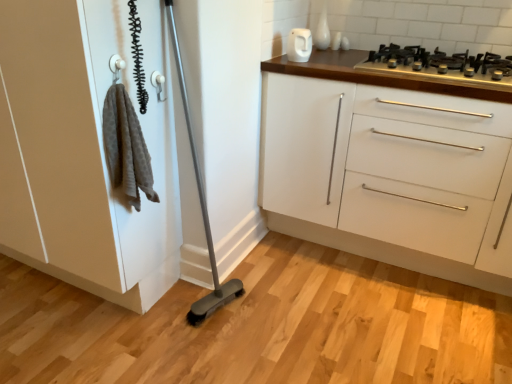
Based on the photo, what is the approximate width of black metal gas stove at upper right?

The width of black metal gas stove at upper right is 22.91 inches.

Image resolution: width=512 pixels, height=384 pixels. I want to click on white matte cabinet at left, so click(83, 150).

What is the approximate height of white glossy cabinet at upper right?

35.63 inches.

Find the location of `black metal gas stove at upper right`. black metal gas stove at upper right is located at coordinates (441, 65).

Considering the relative sizes of white glossy cabinet at upper right and black metal gas stove at upper right in the image provided, is white glossy cabinet at upper right bigger than black metal gas stove at upper right?

Yes, white glossy cabinet at upper right is bigger than black metal gas stove at upper right.

Where is `gas stove on the right of white glossy cabinet at upper right`? This screenshot has height=384, width=512. gas stove on the right of white glossy cabinet at upper right is located at coordinates (441, 65).

Is white glossy cabinet at upper right taller than black metal gas stove at upper right?

Correct, white glossy cabinet at upper right is much taller as black metal gas stove at upper right.

Does point (288, 202) come closer to viewer compared to point (430, 55)?

No.

From the image's perspective, is white glossy electric kettle at upper center above white glossy cabinet at upper right?

Indeed, from the image's perspective, white glossy electric kettle at upper center is shown above white glossy cabinet at upper right.

Considering the relative sizes of white glossy electric kettle at upper center and white glossy cabinet at upper right in the image provided, is white glossy electric kettle at upper center wider than white glossy cabinet at upper right?

No, white glossy electric kettle at upper center is not wider than white glossy cabinet at upper right.

In the scene shown: From a real-world perspective, is white glossy electric kettle at upper center beneath white glossy cabinet at upper right?

No, from a real-world perspective, white glossy electric kettle at upper center is not under white glossy cabinet at upper right.

Is white glossy cabinet at upper right at the back of white glossy electric kettle at upper center?

No, white glossy electric kettle at upper center is not facing away from white glossy cabinet at upper right.

Is white glossy cabinet at upper right oriented towards white matte cabinet at left?

No, white glossy cabinet at upper right is not oriented towards white matte cabinet at left.

Can you confirm if white glossy cabinet at upper right is wider than white matte cabinet at left?

Correct, the width of white glossy cabinet at upper right exceeds that of white matte cabinet at left.

What's the angular difference between white glossy cabinet at upper right and white matte cabinet at left's facing directions?

1.75 degrees.

Which is closer, (279, 202) or (120, 280)?

Point (279, 202) appears to be farther away from the viewer than point (120, 280).

Locate an element on the screen. The width and height of the screenshot is (512, 384). appliance above the white matte cabinet at left (from the image's perspective) is located at coordinates (298, 45).

From a real-world perspective, is white glossy electric kettle at upper center positioned over white matte cabinet at left based on gravity?

Correct, in the physical world, white glossy electric kettle at upper center is higher than white matte cabinet at left.

From the image's perspective, is white glossy electric kettle at upper center over white matte cabinet at left?

Yes, from the image's perspective, white glossy electric kettle at upper center is above white matte cabinet at left.

Considering the positions of objects white glossy electric kettle at upper center and white matte cabinet at left in the image provided, who is more to the left, white glossy electric kettle at upper center or white matte cabinet at left?

From the viewer's perspective, white matte cabinet at left appears more on the left side.

Which object is wider, white plastic door handle at upper center or black metal gas stove at upper right?

Wider between the two is black metal gas stove at upper right.

Looking at this image, considering the relative positions of white plastic door handle at upper center and black metal gas stove at upper right in the image provided, is white plastic door handle at upper center to the left of black metal gas stove at upper right from the viewer's perspective?

Indeed, white plastic door handle at upper center is positioned on the left side of black metal gas stove at upper right.

From the picture: From a real-world perspective, is white plastic door handle at upper center on black metal gas stove at upper right?

No.

In the scene shown: How distant is white plastic door handle at upper center from black metal gas stove at upper right?

3.66 feet.

Relative to white glossy electric kettle at upper center, is white glossy cabinet at upper right in front or behind?

In the image, white glossy cabinet at upper right appears in front of white glossy electric kettle at upper center.

Is white glossy cabinet at upper right facing away from white glossy electric kettle at upper center?

No, white glossy cabinet at upper right's orientation is not away from white glossy electric kettle at upper center.

Considering the sizes of objects white glossy cabinet at upper right and white glossy electric kettle at upper center in the image provided, who is wider, white glossy cabinet at upper right or white glossy electric kettle at upper center?

With larger width is white glossy cabinet at upper right.

Does white glossy cabinet at upper right appear on the right side of white glossy electric kettle at upper center?

Indeed, white glossy cabinet at upper right is positioned on the right side of white glossy electric kettle at upper center.

Looking at this image, visually, is black metal gas stove at upper right positioned to the left or to the right of white glossy electric kettle at upper center?

black metal gas stove at upper right is positioned on white glossy electric kettle at upper center's right side.

Can you tell me how much black metal gas stove at upper right and white glossy electric kettle at upper center differ in facing direction?

There is a 2.72-degree angle between the facing directions of black metal gas stove at upper right and white glossy electric kettle at upper center.

Which point is more distant from viewer, (446, 71) or (298, 42)?

Point (298, 42)

Between black metal gas stove at upper right and white glossy electric kettle at upper center, which one has larger size?

Bigger between the two is black metal gas stove at upper right.

Where is `gas stove lying on the right of white glossy cabinet at upper right`? The height and width of the screenshot is (384, 512). gas stove lying on the right of white glossy cabinet at upper right is located at coordinates (441, 65).

Locate an element on the screen. This screenshot has height=384, width=512. appliance on the left of white glossy cabinet at upper right is located at coordinates (298, 45).

Based on their spatial positions, is white glossy electric kettle at upper center or white matte cabinet at left closer to white glossy cabinet at upper right?

white glossy electric kettle at upper center lies closer to white glossy cabinet at upper right than the other object.

Considering their positions, is black metal gas stove at upper right positioned closer to white plastic door handle at upper center than white glossy electric kettle at upper center?

white glossy electric kettle at upper center is closer to white plastic door handle at upper center.

Considering their positions, is white matte cabinet at left positioned closer to white plastic door handle at upper center than black metal gas stove at upper right?

Among the two, white matte cabinet at left is located nearer to white plastic door handle at upper center.

Looking at the image, which one is located further to white glossy cabinet at upper right, black metal gas stove at upper right or white matte cabinet at left?

Among the two, white matte cabinet at left is located further to white glossy cabinet at upper right.

From the picture: Considering their positions, is white matte cabinet at left positioned further to black metal gas stove at upper right than white glossy electric kettle at upper center?

The object further to black metal gas stove at upper right is white matte cabinet at left.

When comparing their distances from white glossy cabinet at upper right, does white matte cabinet at left or white plastic door handle at upper center seem further?

Among the two, white plastic door handle at upper center is located further to white glossy cabinet at upper right.

Looking at the image, which one is located closer to white glossy cabinet at upper right, white plastic door handle at upper center or black metal gas stove at upper right?

black metal gas stove at upper right lies closer to white glossy cabinet at upper right than the other object.

Based on their spatial positions, is white glossy cabinet at upper right or white glossy electric kettle at upper center closer to white plastic door handle at upper center?

The object closer to white plastic door handle at upper center is white glossy electric kettle at upper center.

Identify the location of the chest of drawers located between white glossy electric kettle at upper center and black metal gas stove at upper right in the left-right direction. This screenshot has width=512, height=384. (379, 176).

Find the location of a particular element. The height and width of the screenshot is (384, 512). door handle situated between white matte cabinet at left and white glossy cabinet at upper right from left to right is located at coordinates (158, 84).

In order to click on door handle between white matte cabinet at left and white glossy electric kettle at upper center in this screenshot , I will do `click(158, 84)`.

Where is `appliance situated between white matte cabinet at left and white glossy cabinet at upper right from left to right`? appliance situated between white matte cabinet at left and white glossy cabinet at upper right from left to right is located at coordinates [x=298, y=45].